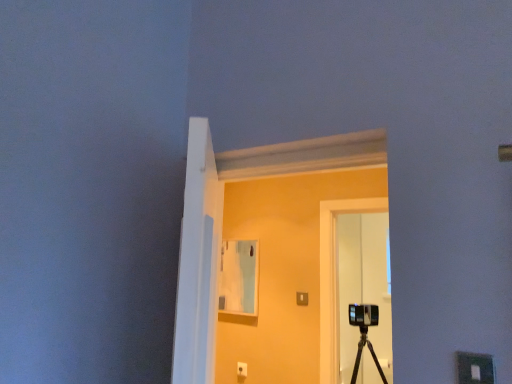
Question: Based on their positions, is transparent glass door at center located to the left or right of transparent glass door at center?

Choices:
 (A) left
 (B) right

Answer: (B)

Question: From the image's perspective, is transparent glass door at center positioned above or below transparent glass door at center?

Choices:
 (A) below
 (B) above

Answer: (A)

Question: Choose the correct answer: Is transparent glass door at center inside transparent glass door at center or outside it?

Choices:
 (A) inside
 (B) outside

Answer: (B)

Question: Considering the positions of point (183, 215) and point (338, 329), is point (183, 215) closer or farther from the camera than point (338, 329)?

Choices:
 (A) closer
 (B) farther

Answer: (A)

Question: Is transparent glass door at center bigger or smaller than transparent glass door at center?

Choices:
 (A) big
 (B) small

Answer: (A)

Question: Would you say transparent glass door at center is to the left or to the right of transparent glass door at center in the picture?

Choices:
 (A) left
 (B) right

Answer: (A)

Question: Which is correct: transparent glass door at center is inside transparent glass door at center, or outside of it?

Choices:
 (A) outside
 (B) inside

Answer: (A)